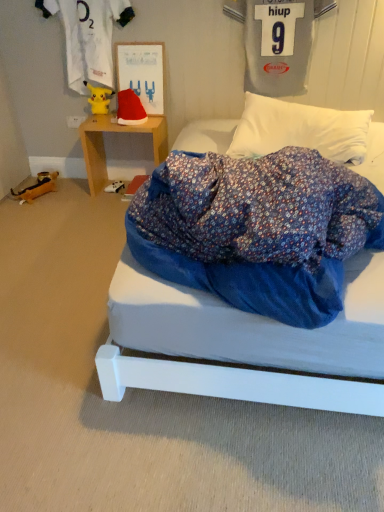
What do you see at coordinates (116, 132) in the screenshot? I see `wooden table at left` at bounding box center [116, 132].

The image size is (384, 512). Describe the element at coordinates (88, 36) in the screenshot. I see `yellow plush toy at upper left, which is counted as the second clothing, starting from the right` at that location.

Based on the photo, measure the distance between wooden toy at left, the 1th toy from the bottom, and camera.

A distance of 2.90 meters exists between wooden toy at left, the 1th toy from the bottom, and camera.

Where is `yellow plush at upper left, which ranks as the second toy in bottom-to-top order`? The image size is (384, 512). yellow plush at upper left, which ranks as the second toy in bottom-to-top order is located at coordinates (99, 98).

Find the location of `fluffy white pillow at upper center`. fluffy white pillow at upper center is located at coordinates (300, 130).

What do you see at coordinates (142, 73) in the screenshot?
I see `matte paperboard at upper center` at bounding box center [142, 73].

Measure the distance between point (x=124, y=71) and camera.

Point (x=124, y=71) and camera are 9.15 feet apart.

What are the coordinates of `wooden table at left` in the screenshot? It's located at (116, 132).

Would you say fluffy white pillow at upper center is outside yellow plush at upper left, acting as the 2th toy starting from the left?

Yes.

From a real-world perspective, between fluffy white pillow at upper center and yellow plush at upper left, the first toy viewed from the right, who is vertically lower?

In real-world perspective, fluffy white pillow at upper center is lower.

Can you confirm if fluffy white pillow at upper center is wider than yellow plush at upper left, the first toy viewed from the right?

Yes, fluffy white pillow at upper center is wider than yellow plush at upper left, the first toy viewed from the right.

Considering the positions of objects fluffy white pillow at upper center and yellow plush at upper left, which ranks as the second toy in bottom-to-top order, in the image provided, who is more to the right, fluffy white pillow at upper center or yellow plush at upper left, which ranks as the second toy in bottom-to-top order,?

From the viewer's perspective, fluffy white pillow at upper center appears more on the right side.

Choose the correct answer: Is wooden toy at left, the second toy when ordered from top to bottom, inside yellow plush toy at upper left, which is counted as the second clothing, starting from the right, or outside it?

wooden toy at left, the second toy when ordered from top to bottom, is spatially situated outside yellow plush toy at upper left, which is counted as the second clothing, starting from the right.

Is wooden toy at left, the 1th toy from the bottom, looking in the opposite direction of yellow plush toy at upper left, which appears as the first clothing when viewed from the left?

wooden toy at left, the 1th toy from the bottom, does not have its back to yellow plush toy at upper left, which appears as the first clothing when viewed from the left.

From a real-world perspective, between wooden toy at left, the second toy when ordered from top to bottom, and yellow plush toy at upper left, which appears as the first clothing when viewed from the left, who is vertically lower?

From a 3D spatial view, wooden toy at left, the second toy when ordered from top to bottom, is below.

From the image's perspective, is wooden table at left on top of yellow plush toy at upper left, which appears as the first clothing when viewed from the left?

No, from the image's perspective, wooden table at left is not over yellow plush toy at upper left, which appears as the first clothing when viewed from the left.

Would you consider wooden table at left to be distant from yellow plush toy at upper left, which appears as the first clothing when viewed from the left?

No, there isn't a large distance between wooden table at left and yellow plush toy at upper left, which appears as the first clothing when viewed from the left.

From the picture: From a real-world perspective, relative to yellow plush toy at upper left, which appears as the first clothing when viewed from the left, is wooden table at left vertically above or below?

From a real-world perspective, wooden table at left is physically below yellow plush toy at upper left, which appears as the first clothing when viewed from the left.

Which object is further away from the camera, fluffy white pillow at upper center or gray jersey at upper right, the 1th clothing positioned from the right?

gray jersey at upper right, the 1th clothing positioned from the right, is further from the camera.

Consider the image. Between fluffy white pillow at upper center and gray jersey at upper right, positioned as the second clothing in left-to-right order, which one has more height?

Standing taller between the two is gray jersey at upper right, positioned as the second clothing in left-to-right order.

From the image's perspective, is fluffy white pillow at upper center beneath gray jersey at upper right, the 1th clothing positioned from the right?

Yes, from the image's perspective, fluffy white pillow at upper center is beneath gray jersey at upper right, the 1th clothing positioned from the right.

Is gray jersey at upper right, the 1th clothing positioned from the right, surrounded by fluffy white pillow at upper center?

No, gray jersey at upper right, the 1th clothing positioned from the right, is not surrounded by fluffy white pillow at upper center.

In the scene shown: Does wooden toy at left, the 1th toy from the bottom, contain matte paperboard at upper center?

No, matte paperboard at upper center is not inside wooden toy at left, the 1th toy from the bottom.

Considering the sizes of objects wooden toy at left, the 1th toy from the bottom, and matte paperboard at upper center in the image provided, who is shorter, wooden toy at left, the 1th toy from the bottom, or matte paperboard at upper center?

wooden toy at left, the 1th toy from the bottom, is shorter.

Is wooden toy at left, the second toy when ordered from top to bottom, smaller than matte paperboard at upper center?

Yes.

Between wooden toy at left, the second toy positioned from the right, and matte paperboard at upper center, which one appears on the right side from the viewer's perspective?

From the viewer's perspective, matte paperboard at upper center appears more on the right side.

At what (x,y) coordinates should I click in order to perform the action: click on table on the left of fluffy white pillow at upper center. Please return your answer as a coordinate pair (x, y). Looking at the image, I should click on (116, 132).

In terms of width, does fluffy white pillow at upper center look wider or thinner when compared to wooden table at left?

In the image, fluffy white pillow at upper center appears to be wider than wooden table at left.

Is fluffy white pillow at upper center bigger than wooden table at left?

Indeed, fluffy white pillow at upper center has a larger size compared to wooden table at left.

Is fluffy white pillow at upper center inside the boundaries of wooden table at left, or outside?

fluffy white pillow at upper center is spatially situated outside wooden table at left.

Which is closer, (110, 9) or (87, 166)?

The point (110, 9) is in front.

Is wooden table at left inside yellow plush toy at upper left, which is counted as the second clothing, starting from the right?

No, yellow plush toy at upper left, which is counted as the second clothing, starting from the right, does not contain wooden table at left.

From a real-world perspective, is yellow plush toy at upper left, which appears as the first clothing when viewed from the left, positioned under wooden table at left based on gravity?

No, from a real-world perspective, yellow plush toy at upper left, which appears as the first clothing when viewed from the left, is not below wooden table at left.

Is yellow plush toy at upper left, which is counted as the second clothing, starting from the right, to the right of wooden table at left from the viewer's perspective?

Incorrect, yellow plush toy at upper left, which is counted as the second clothing, starting from the right, is not on the right side of wooden table at left.

Locate an element on the screen. The height and width of the screenshot is (512, 384). toy above the fluffy white pillow at upper center (from a real-world perspective) is located at coordinates (99, 98).

The image size is (384, 512). Identify the location of the 1st clothing in front of the wooden toy at left, the 1th toy from the bottom. (88, 36).

When comparing their distances from yellow plush at upper left, which ranks as the second toy in bottom-to-top order, does fluffy white pillow at upper center or yellow plush toy at upper left, which appears as the first clothing when viewed from the left, seem closer?

yellow plush toy at upper left, which appears as the first clothing when viewed from the left, lies closer to yellow plush at upper left, which ranks as the second toy in bottom-to-top order, than the other object.

Considering their positions, is yellow plush at upper left, which ranks as the second toy in bottom-to-top order, positioned closer to matte paperboard at upper center than fluffy white pillow at upper center?

yellow plush at upper left, which ranks as the second toy in bottom-to-top order.

Looking at the image, which one is located further to matte paperboard at upper center, wooden toy at left, the second toy positioned from the right, or gray jersey at upper right, the 1th clothing positioned from the right?

wooden toy at left, the second toy positioned from the right.

Which object lies nearer to the anchor point matte paperboard at upper center, wooden table at left or yellow plush at upper left, the first toy viewed from the right?

yellow plush at upper left, the first toy viewed from the right.

Which object lies further to the anchor point matte paperboard at upper center, wooden toy at left, the 1th toy from the bottom, or yellow plush at upper left, which appears as the first toy when viewed from the top?

wooden toy at left, the 1th toy from the bottom, is further to matte paperboard at upper center.

Looking at the image, which one is located closer to wooden table at left, fluffy white pillow at upper center or matte paperboard at upper center?

Among the two, matte paperboard at upper center is located nearer to wooden table at left.

Estimate the real-world distances between objects in this image. Which object is closer to yellow plush toy at upper left, which appears as the first clothing when viewed from the left, fluffy white pillow at upper center or matte paperboard at upper center?

Based on the image, matte paperboard at upper center appears to be nearer to yellow plush toy at upper left, which appears as the first clothing when viewed from the left.

Based on their spatial positions, is gray jersey at upper right, positioned as the second clothing in left-to-right order, or yellow plush toy at upper left, which is counted as the second clothing, starting from the right, closer to yellow plush at upper left, acting as the 2th toy starting from the left?

The object closer to yellow plush at upper left, acting as the 2th toy starting from the left, is yellow plush toy at upper left, which is counted as the second clothing, starting from the right.

In order to click on table situated between wooden toy at left, the second toy when ordered from top to bottom, and fluffy white pillow at upper center from left to right in this screenshot , I will do `click(116, 132)`.

The height and width of the screenshot is (512, 384). I want to click on toy located between wooden toy at left, the 1th toy from the bottom, and gray jersey at upper right, the 1th clothing positioned from the right, in the left-right direction, so pos(99,98).

Where is `table between yellow plush at upper left, acting as the 2th toy starting from the left, and fluffy white pillow at upper center from left to right`? Image resolution: width=384 pixels, height=512 pixels. table between yellow plush at upper left, acting as the 2th toy starting from the left, and fluffy white pillow at upper center from left to right is located at coordinates (116, 132).

Locate an element on the screen. This screenshot has height=512, width=384. table situated between wooden toy at left, the 1th toy from the bottom, and gray jersey at upper right, positioned as the second clothing in left-to-right order, from left to right is located at coordinates (116, 132).